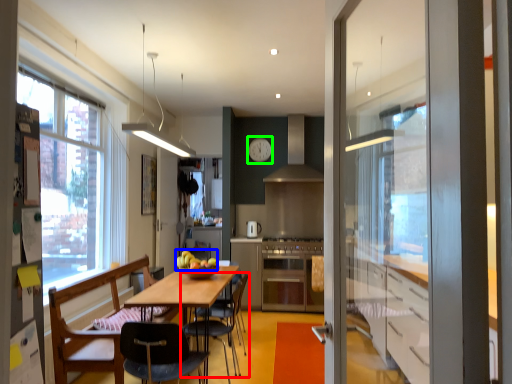
Question: Which object is positioned farthest from chair (highlighted by a red box)? Select from apple (highlighted by a blue box) and clock (highlighted by a green box).

Choices:
 (A) apple
 (B) clock

Answer: (B)